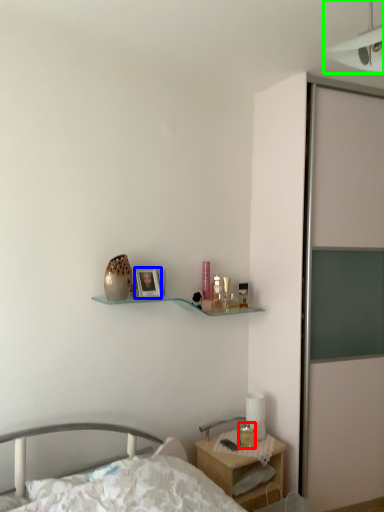
Question: Estimate the real-world distances between objects in this image. Which object is farther from candle holder (highlighted by a red box), picture frame (highlighted by a blue box) or light fixture (highlighted by a green box)?

Choices:
 (A) picture frame
 (B) light fixture

Answer: (B)